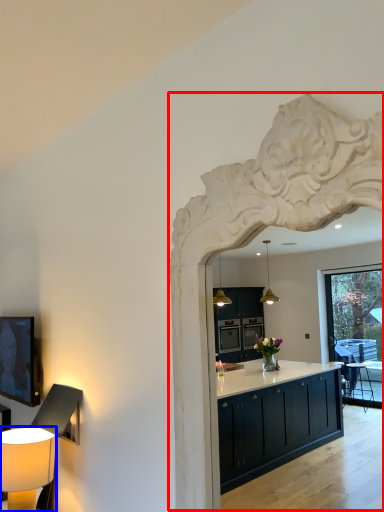
Question: Which object appears closest to the camera in this image, archway (highlighted by a red box) or table lamp (highlighted by a blue box)?

Choices:
 (A) archway
 (B) table lamp

Answer: (A)